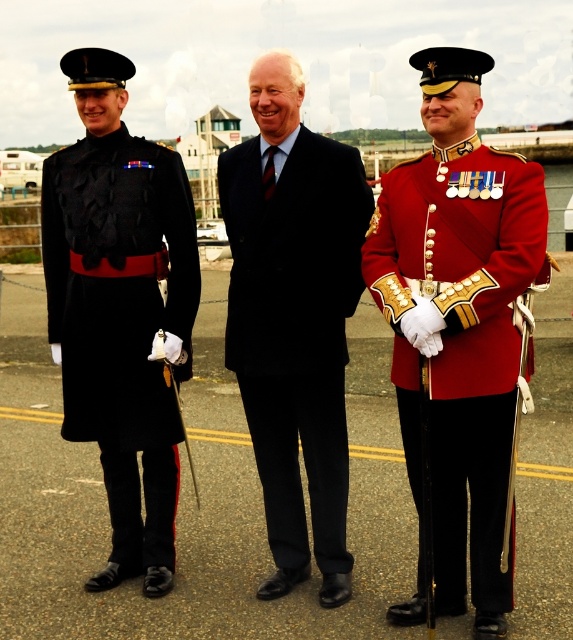
Question: Which object is the closest to the matte black coat at left?

Choices:
 (A) shiny red fabric jacket at center
 (B) navy wool suit at center

Answer: (B)

Question: Is matte black coat at left wider than navy wool suit at center?

Choices:
 (A) yes
 (B) no

Answer: (A)

Question: Which object is closer to the camera taking this photo?

Choices:
 (A) shiny red fabric jacket at center
 (B) navy wool suit at center

Answer: (A)

Question: Can you confirm if matte black coat at left is positioned below navy wool suit at center?

Choices:
 (A) no
 (B) yes

Answer: (B)

Question: Does matte black coat at left have a greater width compared to navy wool suit at center?

Choices:
 (A) yes
 (B) no

Answer: (A)

Question: Which object is positioned farthest from the shiny red fabric jacket at center?

Choices:
 (A) matte black coat at left
 (B) navy wool suit at center

Answer: (A)